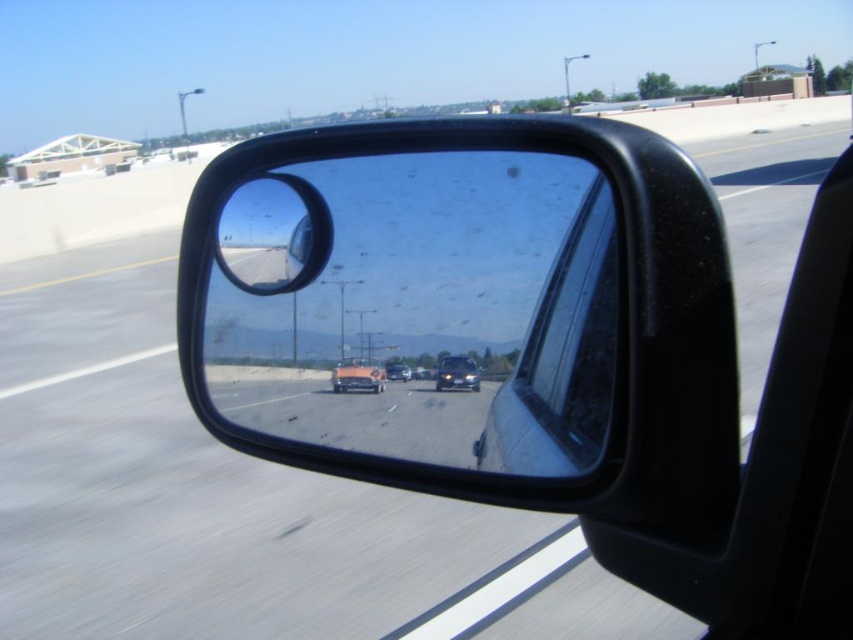
Does clear plastic mirror at center have a lesser height compared to shiny orange car at center?

No, clear plastic mirror at center is not shorter than shiny orange car at center.

In the scene shown: Can you confirm if clear plastic mirror at center is wider than shiny orange car at center?

Yes.

Is point (328, 259) in front of point (373, 369)?

No.

I want to click on clear plastic mirror at center, so click(x=421, y=307).

Can you confirm if glossy black car at center is wider than shiny metallic sedan at center?

Yes, glossy black car at center is wider than shiny metallic sedan at center.

Can you confirm if glossy black car at center is bigger than shiny metallic sedan at center?

Yes, glossy black car at center is bigger than shiny metallic sedan at center.

I want to click on glossy black car at center, so click(x=457, y=372).

Does clear plastic mirror at center have a lesser width compared to shiny metallic sedan at center?

Result: Incorrect, clear plastic mirror at center's width is not less than shiny metallic sedan at center's.

How much distance is there between clear plastic mirror at center and shiny metallic sedan at center?

clear plastic mirror at center is 8.36 inches away from shiny metallic sedan at center.

The image size is (853, 640). What do you see at coordinates (421, 307) in the screenshot?
I see `clear plastic mirror at center` at bounding box center [421, 307].

The image size is (853, 640). In order to click on clear plastic mirror at center in this screenshot , I will do `click(421, 307)`.